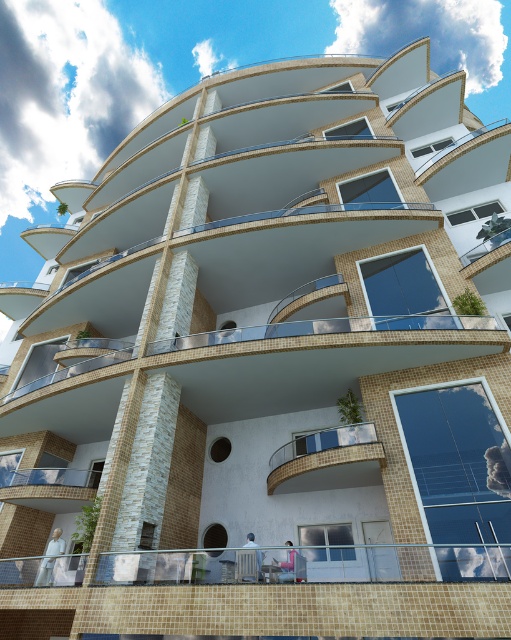
Can you confirm if white glossy balcony at center is thinner than glassy transparent balcony at lower left?

Indeed, white glossy balcony at center has a lesser width compared to glassy transparent balcony at lower left.

Can you confirm if white glossy balcony at center is positioned below glassy transparent balcony at lower left?

No, white glossy balcony at center is not below glassy transparent balcony at lower left.

Image resolution: width=511 pixels, height=640 pixels. Identify the location of white glossy balcony at center. (329, 460).

The height and width of the screenshot is (640, 511). In order to click on white glossy balcony at center in this screenshot , I will do 329,460.